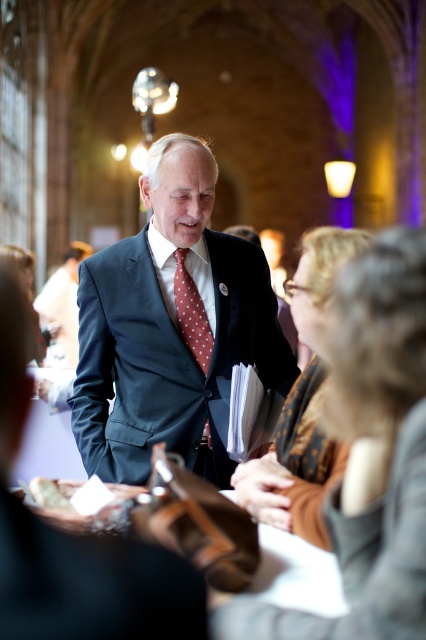
Is brown textured scarf at center taller than polka dot silk tie at center?

Indeed, brown textured scarf at center has a greater height compared to polka dot silk tie at center.

Does point (264, 520) lie in front of point (190, 324)?

Yes, it is.

The height and width of the screenshot is (640, 426). I want to click on brown textured scarf at center, so click(x=302, y=403).

Does matte blue suit at center have a greater height compared to polka dot silk tie at center?

Correct, matte blue suit at center is much taller as polka dot silk tie at center.

Can you confirm if matte blue suit at center is thinner than polka dot silk tie at center?

No.

Between point (169, 449) and point (181, 324), which one is positioned in front?

Positioned in front is point (169, 449).

This screenshot has height=640, width=426. Identify the location of matte blue suit at center. (172, 326).

Identify the location of matte blue suit at center. [x=172, y=326].

Who is taller, matte blue suit at center or brown textured scarf at center?

matte blue suit at center is taller.

Is point (210, 236) in front of point (294, 483)?

No, it is not.

Identify the location of matte blue suit at center. The width and height of the screenshot is (426, 640). (172, 326).